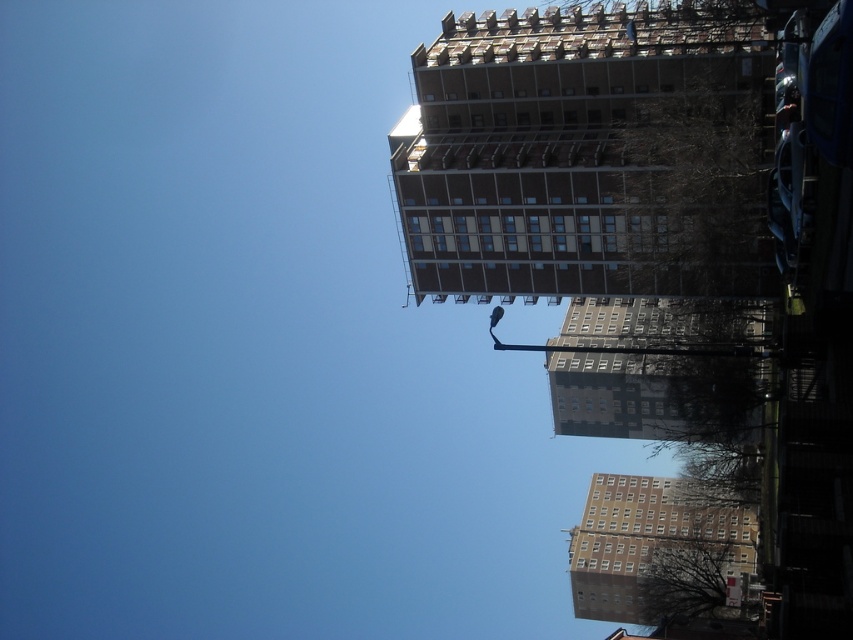
Question: Can you confirm if brown brick building at upper center is smaller than gray concrete building at center?

Choices:
 (A) no
 (B) yes

Answer: (B)

Question: Which object is the closest to the brown concrete building at lower right?

Choices:
 (A) gray concrete building at center
 (B) brown brick building at upper center

Answer: (A)

Question: Does brown concrete building at lower right appear on the left side of gray concrete building at center?

Choices:
 (A) no
 (B) yes

Answer: (A)

Question: Among these objects, which one is farthest from the camera?

Choices:
 (A) gray concrete building at center
 (B) brown concrete building at lower right
 (C) brown brick building at upper center

Answer: (B)

Question: Among these objects, which one is farthest from the camera?

Choices:
 (A) brown brick building at upper center
 (B) gray concrete building at center
 (C) brown concrete building at lower right

Answer: (C)

Question: In this image, where is brown brick building at upper center located relative to gray concrete building at center?

Choices:
 (A) below
 (B) above

Answer: (B)